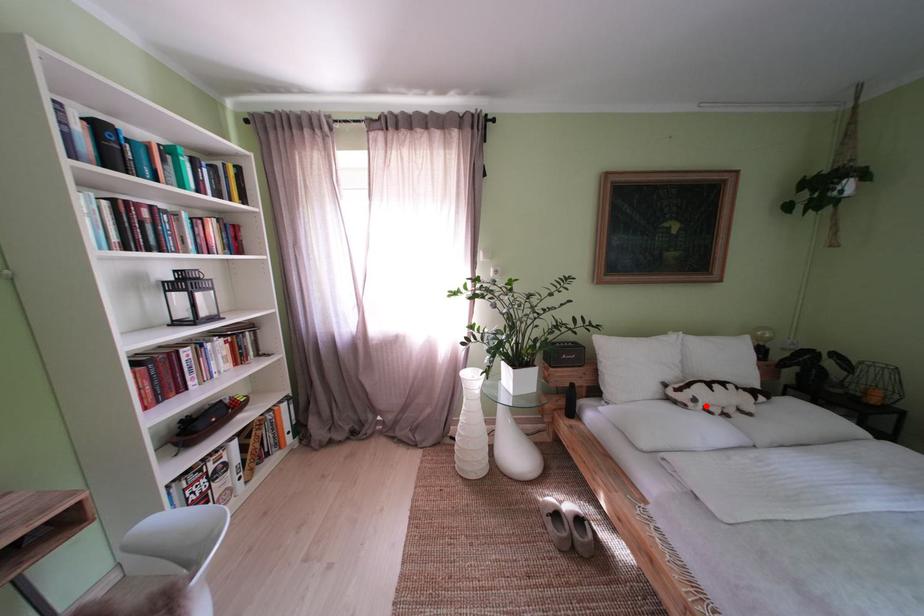
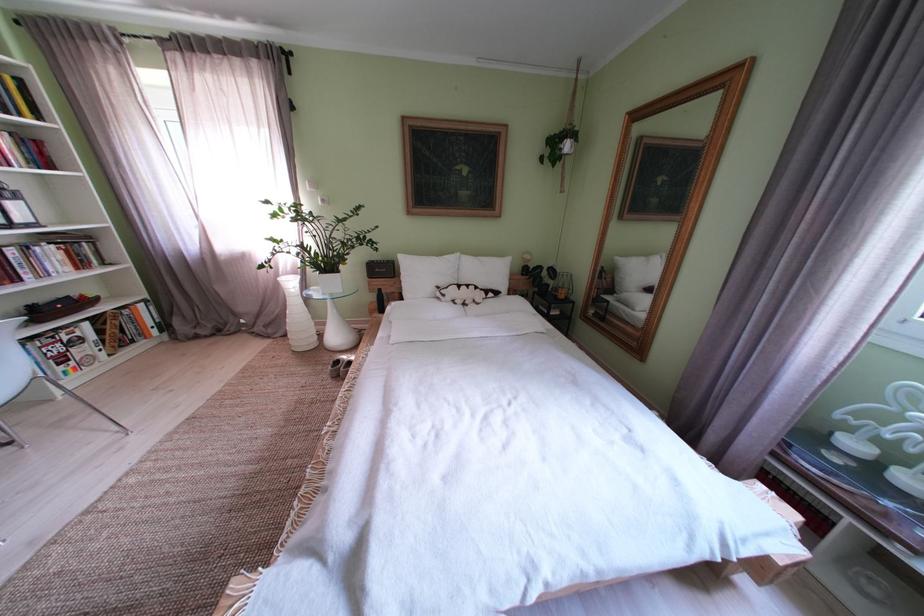
Where in the second image is the point corresponding to the highlighted location from the first image?

(455, 301)